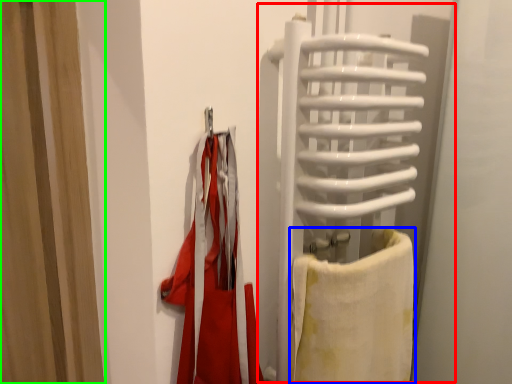
Question: Which is nearer to the screen door (highlighted by a red box)? towel (highlighted by a blue box) or curtain (highlighted by a green box).

Choices:
 (A) towel
 (B) curtain

Answer: (A)